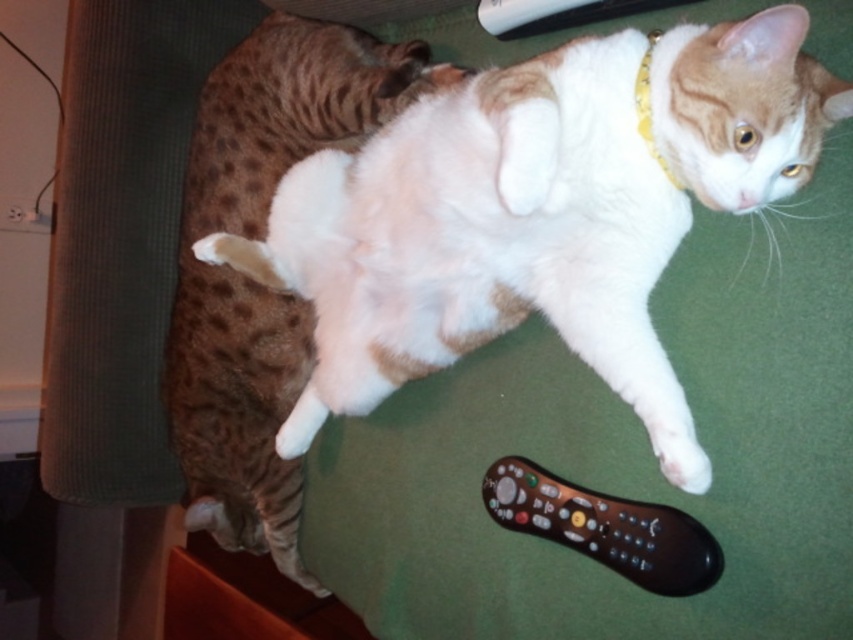
Question: Does tabby fur cat at left appear under gold/yellow fabric neckband at upper right?

Choices:
 (A) no
 (B) yes

Answer: (B)

Question: Which of these objects is positioned farthest from the white fur cat at center?

Choices:
 (A) tabby fur cat at left
 (B) gold/yellow fabric neckband at upper right

Answer: (B)

Question: Considering the real-world distances, which object is farthest from the black plastic remote at lower right?

Choices:
 (A) tabby fur cat at left
 (B) white fur cat at center
 (C) gold/yellow fabric neckband at upper right

Answer: (A)

Question: Estimate the real-world distances between objects in this image. Which object is farther from the black plastic remote at lower right?

Choices:
 (A) white fur cat at center
 (B) tabby fur cat at left

Answer: (B)

Question: Is white fur cat at center wider than tabby fur cat at left?

Choices:
 (A) no
 (B) yes

Answer: (B)

Question: Is white fur cat at center behind black plastic remote at lower right?

Choices:
 (A) yes
 (B) no

Answer: (B)